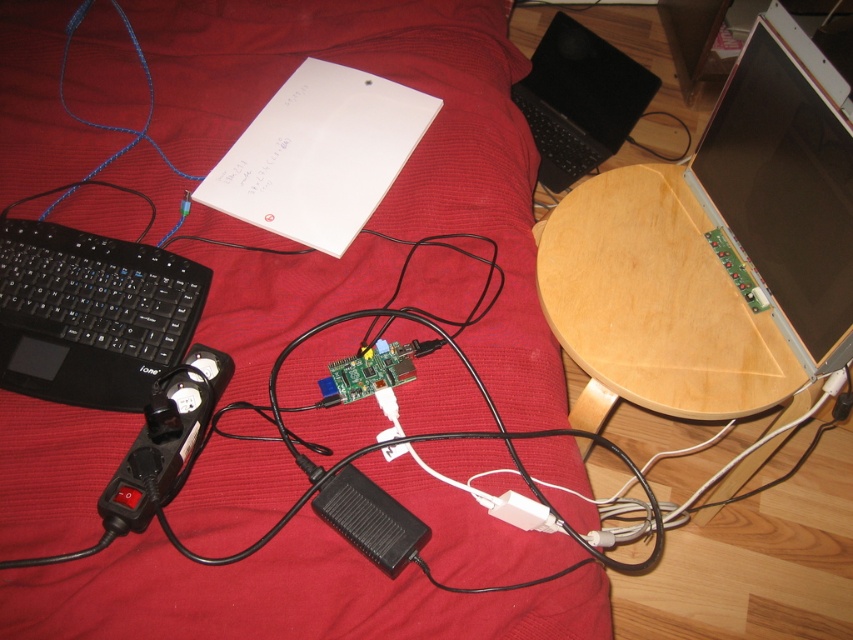
Is red fabric bed at center to the left of black plastic keyboard at left from the viewer's perspective?

In fact, red fabric bed at center is to the right of black plastic keyboard at left.

Which is in front, point (230, 477) or point (102, 387)?

Positioned in front is point (230, 477).

In order to click on red fabric bed at center in this screenshot , I will do `click(410, 154)`.

Does black plastic keyboard at left have a lesser width compared to black plastic laptop at upper center?

Yes.

Can you confirm if black plastic keyboard at left is smaller than black plastic laptop at upper center?

Indeed, black plastic keyboard at left has a smaller size compared to black plastic laptop at upper center.

This screenshot has width=853, height=640. What are the coordinates of `black plastic keyboard at left` in the screenshot? It's located at (91, 314).

Locate an element on the screen. The height and width of the screenshot is (640, 853). black plastic keyboard at left is located at coordinates (91, 314).

Is the position of red fabric bed at center more distant than that of black plastic laptop at upper center?

No, it is not.

Is point (424, 26) positioned after point (543, 58)?

No, it is in front of (543, 58).

At what (x,y) coordinates should I click in order to perform the action: click on red fabric bed at center. Please return your answer as a coordinate pair (x, y). The width and height of the screenshot is (853, 640). Looking at the image, I should click on (410, 154).